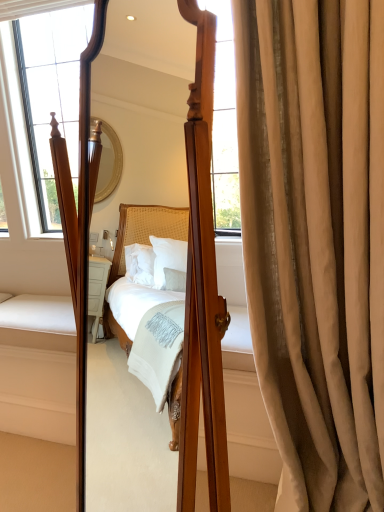
Question: Considering the relative sizes of wooden mirror at center and satin beige curtain at right in the image provided, is wooden mirror at center thinner than satin beige curtain at right?

Choices:
 (A) yes
 (B) no

Answer: (B)

Question: Can you confirm if wooden mirror at center is shorter than satin beige curtain at right?

Choices:
 (A) no
 (B) yes

Answer: (B)

Question: From a real-world perspective, is wooden mirror at center positioned under satin beige curtain at right based on gravity?

Choices:
 (A) yes
 (B) no

Answer: (B)

Question: Considering the relative sizes of wooden mirror at center and satin beige curtain at right in the image provided, is wooden mirror at center bigger than satin beige curtain at right?

Choices:
 (A) no
 (B) yes

Answer: (B)

Question: Can you confirm if wooden mirror at center is taller than satin beige curtain at right?

Choices:
 (A) no
 (B) yes

Answer: (A)

Question: Does wooden mirror at center lie in front of satin beige curtain at right?

Choices:
 (A) no
 (B) yes

Answer: (B)

Question: Can you confirm if satin beige curtain at right is positioned to the left of wooden mirror at center?

Choices:
 (A) yes
 (B) no

Answer: (B)

Question: Does satin beige curtain at right have a lesser height compared to wooden mirror at center?

Choices:
 (A) no
 (B) yes

Answer: (A)

Question: Considering the relative positions of satin beige curtain at right and wooden mirror at center in the image provided, is satin beige curtain at right behind wooden mirror at center?

Choices:
 (A) no
 (B) yes

Answer: (B)

Question: Considering the relative sizes of satin beige curtain at right and wooden mirror at center in the image provided, is satin beige curtain at right taller than wooden mirror at center?

Choices:
 (A) no
 (B) yes

Answer: (B)

Question: From a real-world perspective, is satin beige curtain at right located beneath wooden mirror at center?

Choices:
 (A) no
 (B) yes

Answer: (B)

Question: Is satin beige curtain at right smaller than wooden mirror at center?

Choices:
 (A) yes
 (B) no

Answer: (A)

Question: Considering the positions of wooden mirror at center and satin beige curtain at right in the image, is wooden mirror at center wider or thinner than satin beige curtain at right?

Choices:
 (A) thin
 (B) wide

Answer: (B)